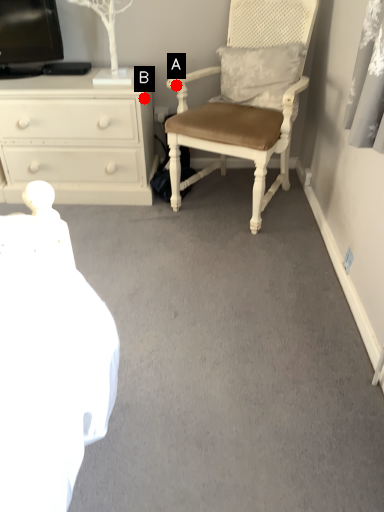
Question: Two points are circled on the image, labeled by A and B beside each circle. Which point is closer to the camera taking this photo?

Choices:
 (A) A is closer
 (B) B is closer

Answer: (B)